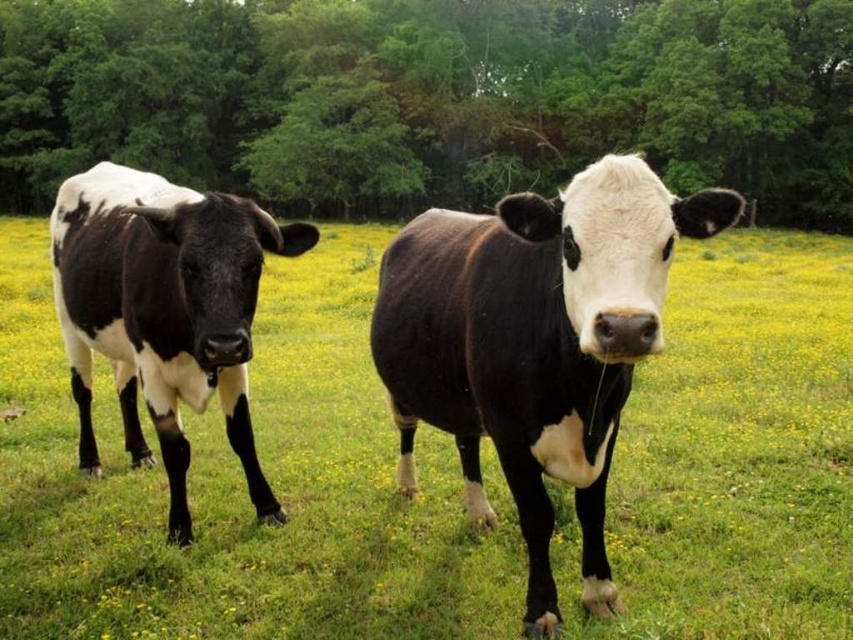
Question: Does green leafy tree at upper center appear under black glossy cow at center?

Choices:
 (A) no
 (B) yes

Answer: (A)

Question: Which point is farther from the camera taking this photo?

Choices:
 (A) (161, 184)
 (B) (506, 444)
 (C) (341, 209)

Answer: (C)

Question: Which of the following is the closest to the observer?

Choices:
 (A) (177, 240)
 (B) (663, 621)
 (C) (535, 497)

Answer: (C)

Question: Can you confirm if black and white cow at center is positioned below black and white cow at left?

Choices:
 (A) yes
 (B) no

Answer: (B)

Question: Which object is positioned closest to the black glossy cow at center?

Choices:
 (A) black and white cow at center
 (B) black and white cow at left
 (C) green leafy tree at upper center

Answer: (B)

Question: Is the position of black and white cow at center less distant than that of black glossy cow at center?

Choices:
 (A) yes
 (B) no

Answer: (B)